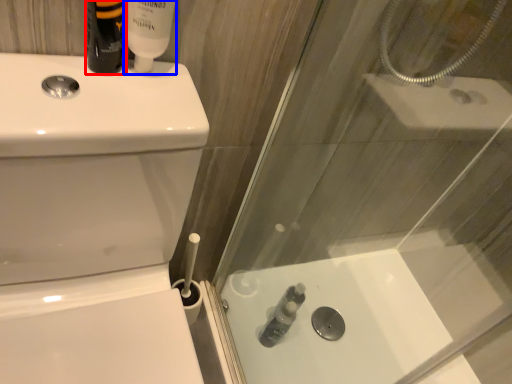
Question: Which object is further to the camera taking this photo, toiletry (highlighted by a red box) or toiletry (highlighted by a blue box)?

Choices:
 (A) toiletry
 (B) toiletry

Answer: (B)